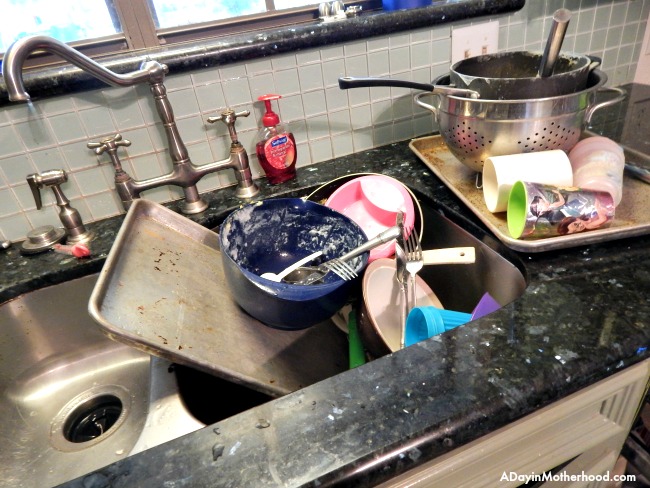
Where is `pans`? This screenshot has width=650, height=488. pans is located at coordinates (181, 288), (545, 71).